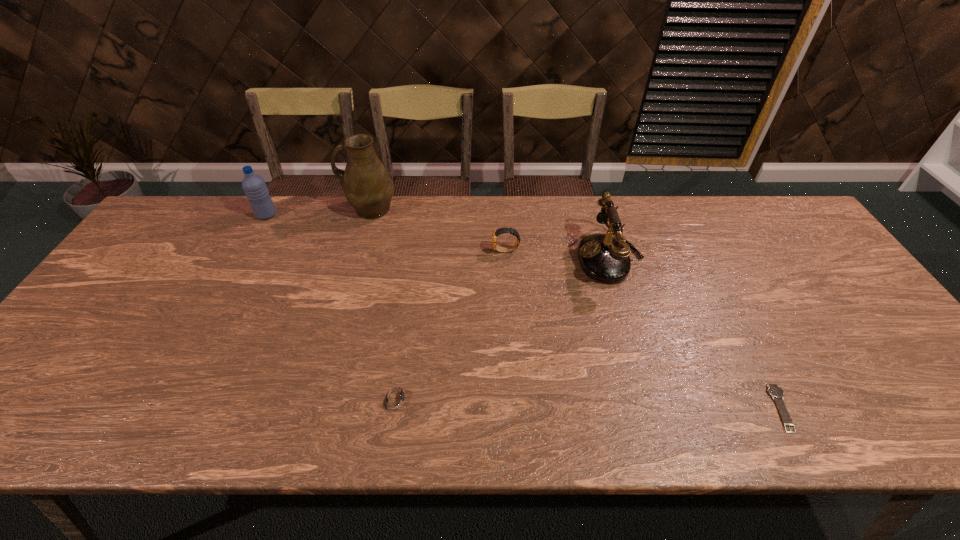
Identify the location of the tallest object. The image size is (960, 540). (367, 185).

In order to click on pitcher in this screenshot , I will do `click(367, 185)`.

Find the location of a particular element. This screenshot has height=540, width=960. the leftmost object is located at coordinates (254, 186).

At what (x,y) coordinates should I click in order to perform the action: click on telephone. Please return your answer as a coordinate pair (x, y). Image resolution: width=960 pixels, height=540 pixels. Looking at the image, I should click on (602, 257).

Locate an element on the screen. The image size is (960, 540). the third shortest object is located at coordinates (499, 231).

This screenshot has width=960, height=540. In order to click on the second watch from left to right in this screenshot , I will do `click(499, 231)`.

Find the location of a particular element. This screenshot has height=540, width=960. the second shortest object is located at coordinates (394, 398).

Where is `the second shortest watch`? This screenshot has width=960, height=540. the second shortest watch is located at coordinates (394, 398).

Locate an element on the screen. The height and width of the screenshot is (540, 960). the rightmost object is located at coordinates (774, 390).

The width and height of the screenshot is (960, 540). Find the location of `the shortest watch`. the shortest watch is located at coordinates pyautogui.click(x=774, y=390).